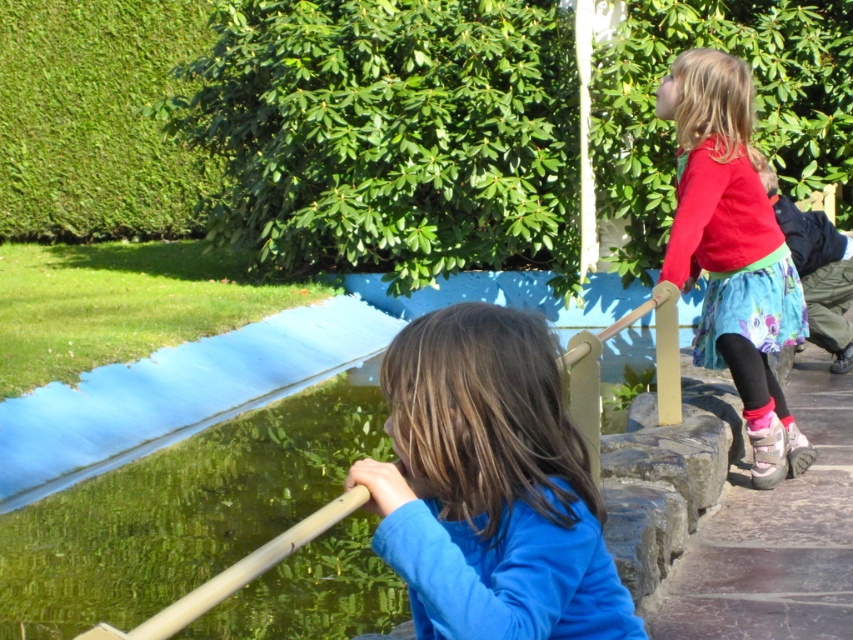
Question: Can you confirm if blue matte shirt at center is positioned to the left of green translucent water at center?

Choices:
 (A) yes
 (B) no

Answer: (A)

Question: Which object is closer to the camera taking this photo?

Choices:
 (A) floral skirt at upper right
 (B) red cotton shirt at upper right

Answer: (B)

Question: Is red cotton shirt at upper right behind floral skirt at upper right?

Choices:
 (A) no
 (B) yes

Answer: (A)

Question: Is blue matte shirt at center thinner than green translucent water at center?

Choices:
 (A) yes
 (B) no

Answer: (B)

Question: Which of the following is the closest to the observer?

Choices:
 (A) green translucent water at center
 (B) red cotton shirt at upper right

Answer: (A)

Question: Among these points, which one is farthest from the camera?

Choices:
 (A) (840, 275)
 (B) (437, 312)
 (C) (682, 280)

Answer: (A)